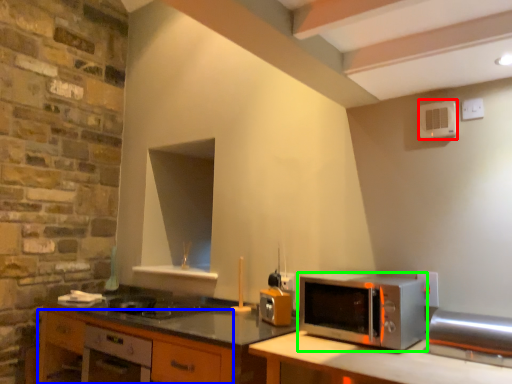
Question: Considering the real-world distances, which object is closest to appliance (highlighted by a red box)? cabinetry (highlighted by a blue box) or microwave oven (highlighted by a green box).

Choices:
 (A) cabinetry
 (B) microwave oven

Answer: (B)